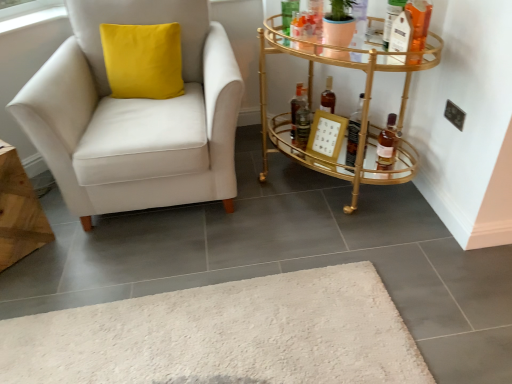
Question: Is the surface of gold metallic bar cart at right in direct contact with gold metallic picture frame at center right?

Choices:
 (A) no
 (B) yes

Answer: (A)

Question: Is there a large distance between gold metallic bar cart at right and gold metallic picture frame at center right?

Choices:
 (A) no
 (B) yes

Answer: (A)

Question: Does gold metallic bar cart at right have a smaller size compared to gold metallic picture frame at center right?

Choices:
 (A) no
 (B) yes

Answer: (A)

Question: Is gold metallic bar cart at right to the left of gold metallic picture frame at center right from the viewer's perspective?

Choices:
 (A) no
 (B) yes

Answer: (A)

Question: From a real-world perspective, is gold metallic bar cart at right physically above gold metallic picture frame at center right?

Choices:
 (A) yes
 (B) no

Answer: (A)

Question: In the image, is gold metallic picture frame at center right positioned in front of or behind gold metallic bar cart at right?

Choices:
 (A) behind
 (B) front

Answer: (A)

Question: From the image's perspective, relative to gold metallic bar cart at right, is gold metallic picture frame at center right above or below?

Choices:
 (A) above
 (B) below

Answer: (B)

Question: From a real-world perspective, is gold metallic picture frame at center right positioned above or below gold metallic bar cart at right?

Choices:
 (A) above
 (B) below

Answer: (B)

Question: Is gold metallic picture frame at center right wider or thinner than gold metallic bar cart at right?

Choices:
 (A) thin
 (B) wide

Answer: (A)

Question: Is shiny dark brown bottle at center, acting as the 3th bottle starting from the right, inside the boundaries of translucent glass bottle at right, which ranks as the third bottle in left-to-right order, or outside?

Choices:
 (A) outside
 (B) inside

Answer: (A)

Question: Does point (305, 102) appear closer or farther from the camera than point (377, 163)?

Choices:
 (A) closer
 (B) farther

Answer: (B)

Question: From the image's perspective, relative to translucent glass bottle at right, which ranks as the third bottle in left-to-right order, is shiny dark brown bottle at center, acting as the 3th bottle starting from the right, above or below?

Choices:
 (A) above
 (B) below

Answer: (A)

Question: Looking at the image, does shiny dark brown bottle at center, the 1th bottle positioned from the left, seem bigger or smaller compared to translucent glass bottle at right, which appears as the 1th bottle when viewed from the right?

Choices:
 (A) small
 (B) big

Answer: (A)

Question: Would you say translucent glass bottle at right, which appears as the 1th bottle when viewed from the right, is to the left or to the right of shiny dark brown bottle at center, the 1th bottle positioned from the left, in the picture?

Choices:
 (A) left
 (B) right

Answer: (B)

Question: In the image, is translucent glass bottle at right, which ranks as the third bottle in left-to-right order, positioned in front of or behind shiny dark brown bottle at center, acting as the 3th bottle starting from the right?

Choices:
 (A) behind
 (B) front

Answer: (B)